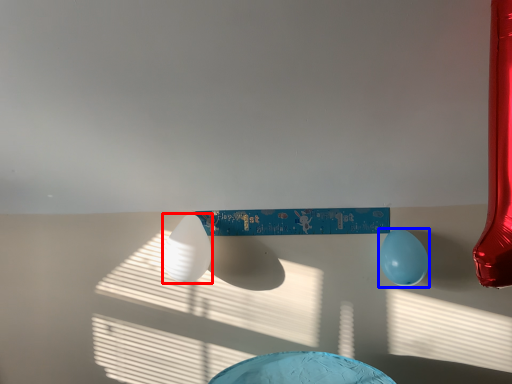
Question: Which point is closer to the camera, balloon (highlighted by a red box) or balloon (highlighted by a blue box)?

Choices:
 (A) balloon
 (B) balloon

Answer: (A)